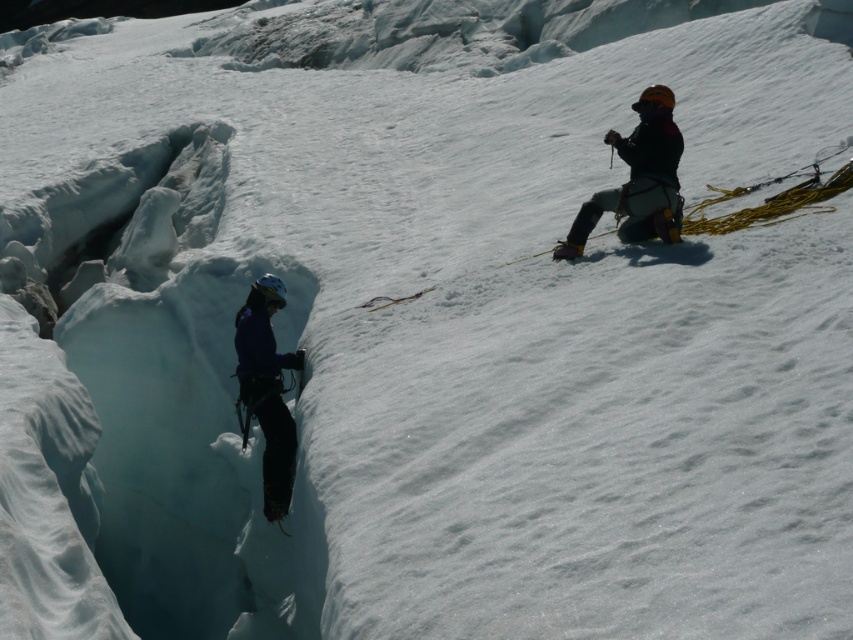
You are an ice climber planning to cross the crevasse between the dark blue fabric jacket at right and the blue fabric jacket at left. The crevasse is 6.67 feet wide. Your safety rope is 5 feet long. Can you safely cross the crevasse using the rope?

The distance between the dark blue fabric jacket at right and the blue fabric jacket at left is 6.67 feet. Since the safety rope is only 5 feet long, it is not long enough to span the crevasse. You would need a longer rope to safely cross.

You are an ice climber who needs to cross a crevasse. You have a rope that is 10 meters long. You see a dark blue fabric jacket at right. Is your rope long enough to reach the other side?

The distance between you and the dark blue fabric jacket at right is 10.90 meters, which is longer than your 10 meter rope. Therefore, the rope is not long enough to reach the other side.

You are an ice climber looking at the scene. You see two climbers with jackets, the dark blue fabric jacket at right and the blue fabric jacket at left. Which jacket is positioned more to the right side of the image?

The dark blue fabric jacket at right is positioned more to the right side of the image than the blue fabric jacket at left.